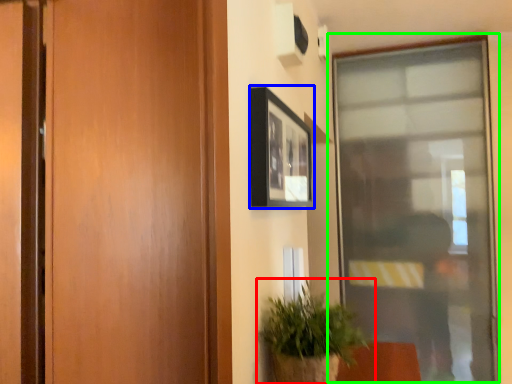
Question: Which is farther away from houseplant (highlighted by a red box)? picture frame (highlighted by a blue box) or window (highlighted by a green box)?

Choices:
 (A) picture frame
 (B) window

Answer: (B)